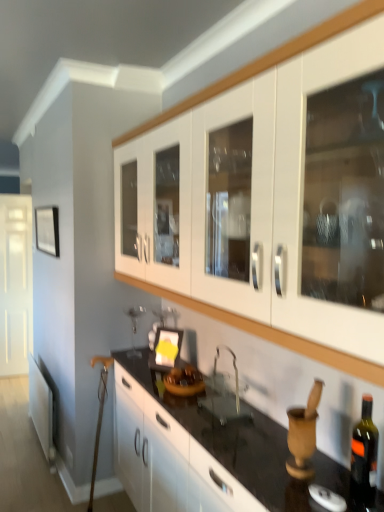
What do you see at coordinates (15, 283) in the screenshot?
I see `white glossy door at left` at bounding box center [15, 283].

Measure the distance between point (53, 255) and camera.

The distance of point (53, 255) from camera is 9.84 feet.

How much space does matte black picture frame at center, which is the 2th picture frame in top-to-bottom order, occupy horizontally?

The width of matte black picture frame at center, which is the 2th picture frame in top-to-bottom order, is 3.89 inches.

What do you see at coordinates (267, 332) in the screenshot? The width and height of the screenshot is (384, 512). I see `white glossy cabinets at upper center, the 1th cabinetry viewed from the top` at bounding box center [267, 332].

The image size is (384, 512). In order to click on white glossy cabinets at upper center, the 1th cabinetry viewed from the top in this screenshot , I will do `click(267, 332)`.

The image size is (384, 512). I want to click on clear glass sink at center, so click(x=225, y=393).

Which object is closer to the camera taking this photo, dark green glass bottle at lower right or white glossy door at left?

Positioned in front is dark green glass bottle at lower right.

Is point (373, 431) less distant than point (25, 222)?

Yes, it is in front of point (25, 222).

Is dark green glass bottle at lower right oriented away from white glossy door at left?

dark green glass bottle at lower right does not have its back to white glossy door at left.

Can you confirm if dark green glass bottle at lower right is wider than white glossy door at left?

In fact, dark green glass bottle at lower right might be narrower than white glossy door at left.

Considering the sizes of objects white glossy cabinets at upper center, the 1th cabinetry viewed from the top, and black glossy countertop at center, which is the second cabinetry from top to bottom, in the image provided, who is thinner, white glossy cabinets at upper center, the 1th cabinetry viewed from the top, or black glossy countertop at center, which is the second cabinetry from top to bottom,?

Thinner between the two is white glossy cabinets at upper center, the 1th cabinetry viewed from the top.

Can you tell me how much white glossy cabinets at upper center, the 1th cabinetry viewed from the top, and black glossy countertop at center, which ranks as the 1th cabinetry in bottom-to-top order, differ in facing direction?

There is a 1-degree angle between the facing directions of white glossy cabinets at upper center, the 1th cabinetry viewed from the top, and black glossy countertop at center, which ranks as the 1th cabinetry in bottom-to-top order.

Measure the distance between white glossy cabinets at upper center, the 1th cabinetry viewed from the top, and black glossy countertop at center, which is the second cabinetry from top to bottom.

white glossy cabinets at upper center, the 1th cabinetry viewed from the top, and black glossy countertop at center, which is the second cabinetry from top to bottom, are 27.05 inches apart from each other.

Looking at this image, from the image's perspective, is white glossy cabinets at upper center, the 1th cabinetry viewed from the top, over black glossy countertop at center, which ranks as the 1th cabinetry in bottom-to-top order?

Indeed, from the image's perspective, white glossy cabinets at upper center, the 1th cabinetry viewed from the top, is shown above black glossy countertop at center, which ranks as the 1th cabinetry in bottom-to-top order.

From the image's perspective, who appears lower, matte black picture frame at left, marked as the second picture frame in a bottom-to-top arrangement, or white glossy cabinets at upper center, the 1th cabinetry viewed from the top?

matte black picture frame at left, marked as the second picture frame in a bottom-to-top arrangement, appears lower in the image.

From a real-world perspective, is matte black picture frame at left, which ranks as the second picture frame in front-to-back order, located beneath white glossy cabinets at upper center, the 1th cabinetry viewed from the top?

Indeed, from a real-world perspective, matte black picture frame at left, which ranks as the second picture frame in front-to-back order, is positioned beneath white glossy cabinets at upper center, the 1th cabinetry viewed from the top.

How much distance is there between matte black picture frame at left, which is counted as the 2th picture frame, starting from the right, and white glossy cabinets at upper center, which appears as the 2th cabinetry when ordered from the bottom?

matte black picture frame at left, which is counted as the 2th picture frame, starting from the right, and white glossy cabinets at upper center, which appears as the 2th cabinetry when ordered from the bottom, are 1.21 meters apart from each other.

Between point (155, 342) and point (48, 238), which one is positioned behind?

The point (48, 238) is more distant.

Is matte black picture frame at center, the second picture frame in the back-to-front sequence, positioned with its back to matte black picture frame at left, which ranks as the second picture frame in front-to-back order?

No, matte black picture frame at center, the second picture frame in the back-to-front sequence,'s orientation is not away from matte black picture frame at left, which ranks as the second picture frame in front-to-back order.

Is matte black picture frame at center, the 1th picture frame positioned from the front, wider or thinner than matte black picture frame at left, which is counted as the 2th picture frame, starting from the right?

Clearly, matte black picture frame at center, the 1th picture frame positioned from the front, has more width compared to matte black picture frame at left, which is counted as the 2th picture frame, starting from the right.

From a real-world perspective, is matte black picture frame at center, the 1th picture frame positioned from the right, beneath matte black picture frame at left, which is counted as the 2th picture frame, starting from the right?

Yes, from a real-world perspective, matte black picture frame at center, the 1th picture frame positioned from the right, is below matte black picture frame at left, which is counted as the 2th picture frame, starting from the right.

Is matte black picture frame at left, which is the 1th picture frame in left-to-right order, at the back of white glossy door at left?

No.

How much distance is there between white glossy door at left and matte black picture frame at left, which is counted as the 2th picture frame, starting from the right?

A distance of 1.68 meters exists between white glossy door at left and matte black picture frame at left, which is counted as the 2th picture frame, starting from the right.

Considering the relative sizes of white glossy door at left and matte black picture frame at left, which ranks as the second picture frame in front-to-back order, in the image provided, is white glossy door at left taller than matte black picture frame at left, which ranks as the second picture frame in front-to-back order,?

Correct, white glossy door at left is much taller as matte black picture frame at left, which ranks as the second picture frame in front-to-back order.

You are a GUI agent. You are given a task and a screenshot of the screen. Output one action in this format:
    pyautogui.click(x=<x>, y=<y>)
    Task: Click on the picture frame above the white glossy door at left (from the image's perspective)
    
    Given the screenshot: What is the action you would take?
    pyautogui.click(x=47, y=230)

Considering the sizes of matte black picture frame at left, acting as the first picture frame starting from the top, and dark green glass bottle at lower right in the image, is matte black picture frame at left, acting as the first picture frame starting from the top, wider or thinner than dark green glass bottle at lower right?

Clearly, matte black picture frame at left, acting as the first picture frame starting from the top, has less width compared to dark green glass bottle at lower right.

From a real-world perspective, is matte black picture frame at left, which ranks as the second picture frame in front-to-back order, under dark green glass bottle at lower right?

No, from a real-world perspective, matte black picture frame at left, which ranks as the second picture frame in front-to-back order, is not under dark green glass bottle at lower right.

Could you measure the distance between matte black picture frame at left, which is counted as the 2th picture frame, starting from the right, and dark green glass bottle at lower right?

A distance of 2.30 meters exists between matte black picture frame at left, which is counted as the 2th picture frame, starting from the right, and dark green glass bottle at lower right.

Consider the image. Is dark green glass bottle at lower right at the back of matte black picture frame at left, which ranks as the 1th picture frame in back-to-front order?

matte black picture frame at left, which ranks as the 1th picture frame in back-to-front order, does not have its back to dark green glass bottle at lower right.

Looking at their sizes, would you say black glossy countertop at center, which ranks as the 1th cabinetry in bottom-to-top order, is wider or thinner than white glossy cabinets at upper center, which appears as the 2th cabinetry when ordered from the bottom?

black glossy countertop at center, which ranks as the 1th cabinetry in bottom-to-top order, is wider than white glossy cabinets at upper center, which appears as the 2th cabinetry when ordered from the bottom.

Is white glossy cabinets at upper center, the 1th cabinetry viewed from the top, a part of black glossy countertop at center, which ranks as the 1th cabinetry in bottom-to-top order?

No, black glossy countertop at center, which ranks as the 1th cabinetry in bottom-to-top order, does not contain white glossy cabinets at upper center, the 1th cabinetry viewed from the top.

Looking at this image, does black glossy countertop at center, which ranks as the 1th cabinetry in bottom-to-top order, come in front of white glossy cabinets at upper center, which appears as the 2th cabinetry when ordered from the bottom?

That is False.

This screenshot has width=384, height=512. Find the location of `bottle in front of the white glossy door at left`. bottle in front of the white glossy door at left is located at coordinates (364, 455).

Identify the location of cabinetry on the left of the white glossy cabinets at upper center, which appears as the 2th cabinetry when ordered from the bottom. The width and height of the screenshot is (384, 512). (167, 458).

When comparing their distances from white glossy cabinets at upper center, the 1th cabinetry viewed from the top, does matte black picture frame at center, the second picture frame positioned from the left, or dark green glass bottle at lower right seem further?

The object further to white glossy cabinets at upper center, the 1th cabinetry viewed from the top, is matte black picture frame at center, the second picture frame positioned from the left.

Estimate the real-world distances between objects in this image. Which object is closer to black glossy countertop at center, which is the second cabinetry from top to bottom, matte black picture frame at center, which is the 2th picture frame in top-to-bottom order, or white glossy cabinets at upper center, which appears as the 2th cabinetry when ordered from the bottom?

matte black picture frame at center, which is the 2th picture frame in top-to-bottom order.

When comparing their distances from white glossy cabinets at upper center, which appears as the 2th cabinetry when ordered from the bottom, does clear glass sink at center or black glossy countertop at center, which is the second cabinetry from top to bottom, seem closer?

clear glass sink at center.

Considering their positions, is matte black picture frame at center, the 1th picture frame positioned from the right, positioned closer to black glossy countertop at center, which ranks as the 1th cabinetry in bottom-to-top order, than dark green glass bottle at lower right?

matte black picture frame at center, the 1th picture frame positioned from the right, is closer to black glossy countertop at center, which ranks as the 1th cabinetry in bottom-to-top order.

When comparing their distances from dark green glass bottle at lower right, does white glossy cabinets at upper center, the 1th cabinetry viewed from the top, or white glossy door at left seem closer?

Among the two, white glossy cabinets at upper center, the 1th cabinetry viewed from the top, is located nearer to dark green glass bottle at lower right.

From the image, which object appears to be farther from white glossy cabinets at upper center, the 1th cabinetry viewed from the top, matte black picture frame at center, which is the 2th picture frame in top-to-bottom order, or white glossy door at left?

The object further to white glossy cabinets at upper center, the 1th cabinetry viewed from the top, is white glossy door at left.

Considering their positions, is black glossy countertop at center, which ranks as the 1th cabinetry in bottom-to-top order, positioned further to matte black picture frame at left, acting as the first picture frame starting from the top, than dark green glass bottle at lower right?

The object further to matte black picture frame at left, acting as the first picture frame starting from the top, is dark green glass bottle at lower right.

Based on their spatial positions, is matte black picture frame at left, which ranks as the 1th picture frame in back-to-front order, or black glossy countertop at center, which is the second cabinetry from top to bottom, further from clear glass sink at center?

matte black picture frame at left, which ranks as the 1th picture frame in back-to-front order, is positioned further to the anchor clear glass sink at center.

The image size is (384, 512). What are the coordinates of `sink between matte black picture frame at left, which ranks as the 1th picture frame in back-to-front order, and dark green glass bottle at lower right from left to right` in the screenshot? It's located at (225, 393).

In order to click on bottle between white glossy cabinets at upper center, which appears as the 2th cabinetry when ordered from the bottom, and black glossy countertop at center, which ranks as the 1th cabinetry in bottom-to-top order, vertically in this screenshot , I will do `click(364, 455)`.

Locate an element on the screen. sink between white glossy cabinets at upper center, which appears as the 2th cabinetry when ordered from the bottom, and matte black picture frame at left, acting as the first picture frame starting from the top, from front to back is located at coordinates (225, 393).

Locate an element on the screen. This screenshot has height=512, width=384. cabinetry between white glossy cabinets at upper center, the 1th cabinetry viewed from the top, and matte black picture frame at left, which ranks as the second picture frame in front-to-back order, in the front-back direction is located at coordinates [x=167, y=458].